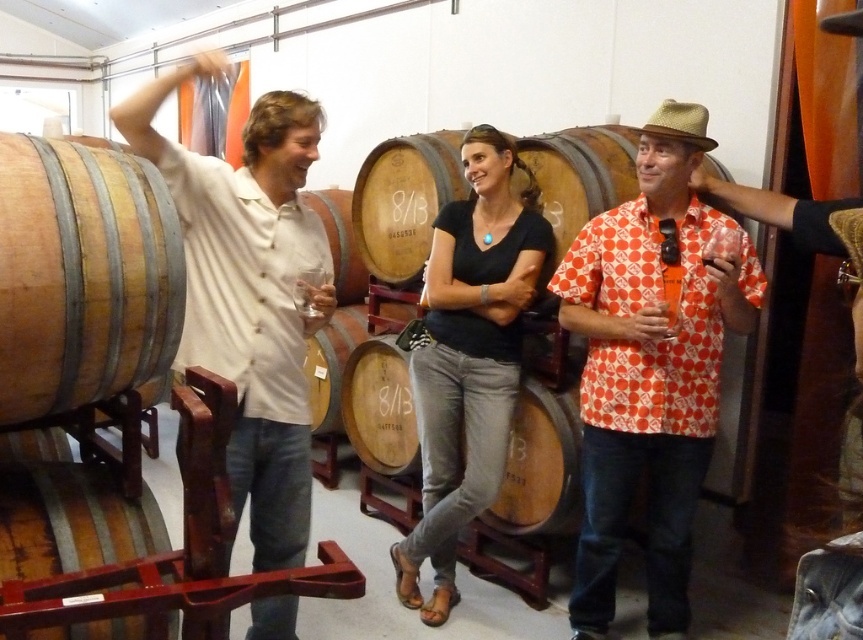
Question: Which object is positioned farthest from the wooden barrel at left?

Choices:
 (A) light beige shirt at left
 (B) wooden barrel at lower left
 (C) orange dotted shirt at center

Answer: (C)

Question: Is light beige shirt at left positioned in front of wooden barrel at lower left?

Choices:
 (A) no
 (B) yes

Answer: (A)

Question: Is orange dotted shirt at center bigger than wooden barrel at left?

Choices:
 (A) yes
 (B) no

Answer: (A)

Question: Which of the following is the farthest from the observer?

Choices:
 (A) wooden barrel at lower left
 (B) wooden barrel at left
 (C) black matte shirt at center

Answer: (C)

Question: Does orange dotted shirt at center come behind wooden barrel at lower left?

Choices:
 (A) no
 (B) yes

Answer: (B)

Question: Which of the following is the farthest from the observer?

Choices:
 (A) (319, 132)
 (B) (502, 384)
 (C) (165, 228)

Answer: (B)